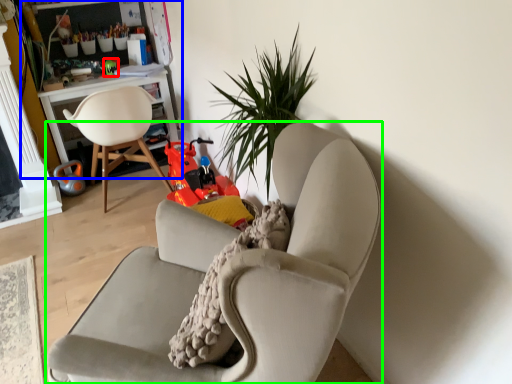
Question: Which object is positioned closest to toy (highlighted by a red box)? Select from bookshelf (highlighted by a blue box) and chair (highlighted by a green box).

Choices:
 (A) bookshelf
 (B) chair

Answer: (A)